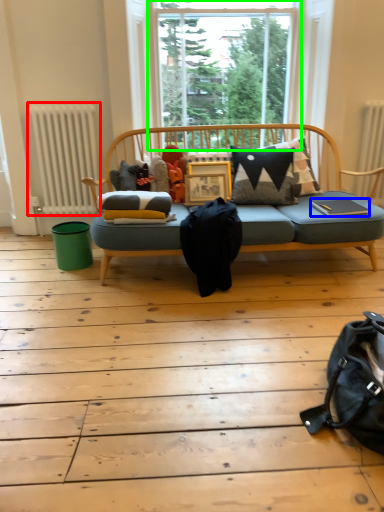
Question: Which is farther away from radiator (highlighted by a red box)? book (highlighted by a blue box) or window (highlighted by a green box)?

Choices:
 (A) book
 (B) window

Answer: (A)